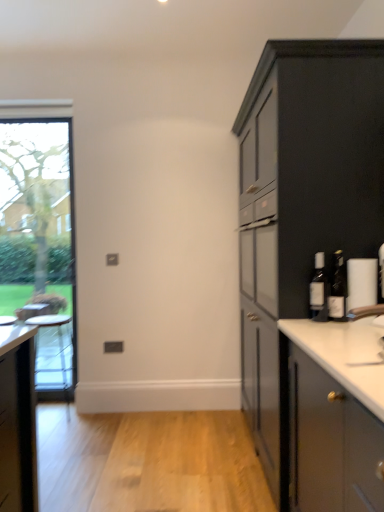
The width and height of the screenshot is (384, 512). What do you see at coordinates (337, 289) in the screenshot?
I see `matte glass bottle at right, the second bottle when ordered from left to right` at bounding box center [337, 289].

What is the approximate width of matte gray cabinet at right?

29.14 inches.

I want to click on white glossy table at left, so click(x=59, y=342).

The height and width of the screenshot is (512, 384). Find the location of `matte glass bottle at right, the second bottle when ordered from left to right`. matte glass bottle at right, the second bottle when ordered from left to right is located at coordinates (337, 289).

Is the surface of matte glass bottle at right, marked as the 1th bottle in a right-to-left arrangement, in direct contact with translucent glass bottle at right, the second bottle viewed from the right?

Yes, matte glass bottle at right, marked as the 1th bottle in a right-to-left arrangement, is next to translucent glass bottle at right, the second bottle viewed from the right.

Consider the image. Is matte glass bottle at right, the second bottle when ordered from left to right, at the right side of translucent glass bottle at right, which is the first bottle from left to right?

Yes, matte glass bottle at right, the second bottle when ordered from left to right, is to the right of translucent glass bottle at right, which is the first bottle from left to right.

Between matte glass bottle at right, marked as the 1th bottle in a right-to-left arrangement, and translucent glass bottle at right, which is the first bottle from left to right, which one has smaller size?

matte glass bottle at right, marked as the 1th bottle in a right-to-left arrangement.

Does matte glass bottle at right, the second bottle when ordered from left to right, have a lesser height compared to translucent glass bottle at right, the second bottle viewed from the right?

Incorrect, the height of matte glass bottle at right, the second bottle when ordered from left to right, does not fall short of that of translucent glass bottle at right, the second bottle viewed from the right.

From the image's perspective, which is above, translucent glass bottle at right, the second bottle viewed from the right, or white glossy table at left?

translucent glass bottle at right, the second bottle viewed from the right.

Are translucent glass bottle at right, which is the first bottle from left to right, and white glossy table at left located far from each other?

Yes, translucent glass bottle at right, which is the first bottle from left to right, and white glossy table at left are quite far apart.

How distant is translucent glass bottle at right, which is the first bottle from left to right, from white glossy table at left?

translucent glass bottle at right, which is the first bottle from left to right, and white glossy table at left are 6.88 feet apart.

Is translucent glass bottle at right, which is the first bottle from left to right, looking in the opposite direction of white glossy table at left?

No, translucent glass bottle at right, which is the first bottle from left to right, is not facing away from white glossy table at left.

Between clear glass window at left and matte glass bottle at right, the second bottle when ordered from left to right, which one is positioned in front?

matte glass bottle at right, the second bottle when ordered from left to right, is closer to the camera.

Is matte glass bottle at right, the second bottle when ordered from left to right, surrounded by clear glass window at left?

No, clear glass window at left does not contain matte glass bottle at right, the second bottle when ordered from left to right.

Does clear glass window at left turn towards matte glass bottle at right, marked as the 1th bottle in a right-to-left arrangement?

No, clear glass window at left is not turned towards matte glass bottle at right, marked as the 1th bottle in a right-to-left arrangement.

How different are the orientations of matte glass bottle at right, the second bottle when ordered from left to right, and clear glass window at left in degrees?

matte glass bottle at right, the second bottle when ordered from left to right, and clear glass window at left are facing 23.5 degrees away from each other.

From the picture: Considering the relative sizes of matte glass bottle at right, marked as the 1th bottle in a right-to-left arrangement, and clear glass window at left in the image provided, is matte glass bottle at right, marked as the 1th bottle in a right-to-left arrangement, taller than clear glass window at left?

No, matte glass bottle at right, marked as the 1th bottle in a right-to-left arrangement, is not taller than clear glass window at left.

From a real-world perspective, relative to clear glass window at left, is matte glass bottle at right, marked as the 1th bottle in a right-to-left arrangement, vertically above or below?

Clearly, from a real-world perspective, matte glass bottle at right, marked as the 1th bottle in a right-to-left arrangement, is below clear glass window at left.

From a real-world perspective, which object rests below the other?

matte gray cabinet at right, from a real-world perspective.

Based on the photo, which is less distant, (66, 261) or (371, 174)?

Point (66, 261) is farther from the camera than point (371, 174).

I want to click on window behind the matte gray cabinet at right, so click(40, 232).

Between clear glass window at left and matte gray cabinet at right, which one is positioned behind?

clear glass window at left is more distant.

Is white glossy table at left outside of matte glass bottle at right, the second bottle when ordered from left to right?

That's correct, white glossy table at left is outside of matte glass bottle at right, the second bottle when ordered from left to right.

Based on the photo, which of these two, white glossy table at left or matte glass bottle at right, the second bottle when ordered from left to right, stands taller?

white glossy table at left is taller.

From the image's perspective, between white glossy table at left and matte glass bottle at right, the second bottle when ordered from left to right, who is located below?

From the image's view, white glossy table at left is below.

Does point (60, 350) appear closer or farther from the camera than point (336, 261)?

Clearly, point (60, 350) is more distant from the camera than point (336, 261).

Which is more to the left, white glossy table at left or translucent glass bottle at right, the second bottle viewed from the right?

white glossy table at left is more to the left.

Based on the photo, from the image's perspective, which is below, white glossy table at left or translucent glass bottle at right, which is the first bottle from left to right?

white glossy table at left, from the image's perspective.

Is point (64, 362) closer or farther from the camera than point (326, 314)?

Point (64, 362) is farther from the camera than point (326, 314).

Measure the distance from white glossy table at left to translucent glass bottle at right, the second bottle viewed from the right.

6.88 feet.

Where is `bottle lying on the left of matte glass bottle at right, the second bottle when ordered from left to right`? The height and width of the screenshot is (512, 384). bottle lying on the left of matte glass bottle at right, the second bottle when ordered from left to right is located at coordinates (319, 290).

This screenshot has height=512, width=384. Find the location of `the 2nd bottle positioned above the white glossy table at left (from a real-world perspective)`. the 2nd bottle positioned above the white glossy table at left (from a real-world perspective) is located at coordinates (319, 290).

Considering their positions, is matte gray cabinet at right positioned further to clear glass window at left than white glossy table at left?

Based on the image, matte gray cabinet at right appears to be further to clear glass window at left.

When comparing their distances from clear glass window at left, does translucent glass bottle at right, the second bottle viewed from the right, or white glossy table at left seem further?

Among the two, translucent glass bottle at right, the second bottle viewed from the right, is located further to clear glass window at left.

Which object lies nearer to the anchor point translucent glass bottle at right, the second bottle viewed from the right, clear glass window at left or matte gray cabinet at right?

matte gray cabinet at right.

Which object lies nearer to the anchor point white glossy table at left, matte gray cabinet at right or clear glass window at left?

clear glass window at left is closer to white glossy table at left.

From the image, which object appears to be nearer to matte gray cabinet at right, white glossy table at left or clear glass window at left?

Among the two, white glossy table at left is located nearer to matte gray cabinet at right.

From the image, which object appears to be farther from translucent glass bottle at right, the second bottle viewed from the right, matte gray cabinet at right or white glossy table at left?

white glossy table at left is further to translucent glass bottle at right, the second bottle viewed from the right.

Estimate the real-world distances between objects in this image. Which object is further from clear glass window at left, white glossy table at left or matte glass bottle at right, the second bottle when ordered from left to right?

The object further to clear glass window at left is matte glass bottle at right, the second bottle when ordered from left to right.

Considering their positions, is white glossy table at left positioned further to matte glass bottle at right, the second bottle when ordered from left to right, than translucent glass bottle at right, the second bottle viewed from the right?

white glossy table at left is positioned further to the anchor matte glass bottle at right, the second bottle when ordered from left to right.

You are a GUI agent. You are given a task and a screenshot of the screen. Output one action in this format:
    pyautogui.click(x=<x>, y=<y>)
    Task: Click on the table between clear glass window at left and matte glass bottle at right, marked as the 1th bottle in a right-to-left arrangement, from left to right
    
    Given the screenshot: What is the action you would take?
    pyautogui.click(x=59, y=342)

Identify the location of bottle located between translucent glass bottle at right, which is the first bottle from left to right, and matte gray cabinet at right in the left-right direction. The height and width of the screenshot is (512, 384). (337, 289).

You are a GUI agent. You are given a task and a screenshot of the screen. Output one action in this format:
    pyautogui.click(x=<x>, y=<y>)
    Task: Click on the table between clear glass window at left and matte gray cabinet at right from left to right
    The image size is (384, 512).
    Given the screenshot: What is the action you would take?
    pyautogui.click(x=59, y=342)

Locate an element on the screen. The image size is (384, 512). table between clear glass window at left and translucent glass bottle at right, which is the first bottle from left to right, from left to right is located at coordinates (59, 342).